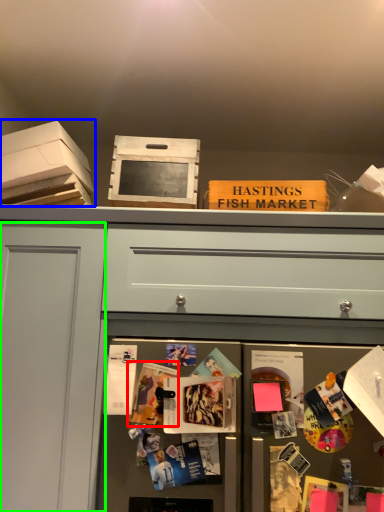
Question: Which object is positioned closest to magazine (highlighted by a red box)? Select from cardboard box (highlighted by a blue box) and glass door (highlighted by a green box).

Choices:
 (A) cardboard box
 (B) glass door

Answer: (B)